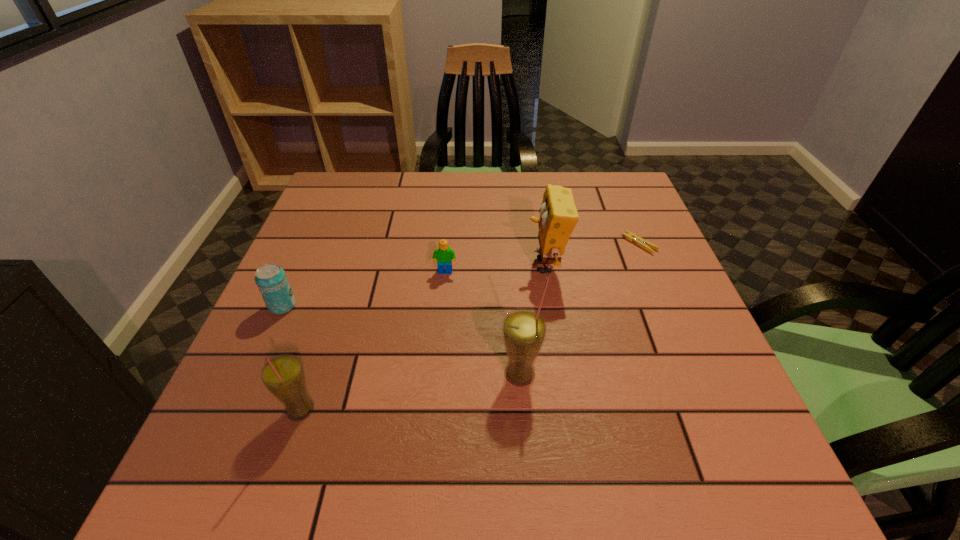
I want to click on free space that is in between the fourth object from right to left and the sponge, so click(x=495, y=269).

Locate an element on the screen. This screenshot has width=960, height=540. empty location between the Lego and the sponge is located at coordinates pyautogui.click(x=495, y=269).

Identify the location of empty location between the leftmost object and the rightmost object. Image resolution: width=960 pixels, height=540 pixels. (461, 275).

Where is `empty space that is in between the Lego and the sponge`? empty space that is in between the Lego and the sponge is located at coordinates (495, 269).

You are a GUI agent. You are given a task and a screenshot of the screen. Output one action in this format:
    pyautogui.click(x=<x>, y=<y>)
    Task: Click on the third closest object to the sponge
    
    Given the screenshot: What is the action you would take?
    pyautogui.click(x=444, y=255)

This screenshot has height=540, width=960. I want to click on the fifth closest object to the clothespin, so click(x=271, y=280).

The width and height of the screenshot is (960, 540). I want to click on blank space that satisfies the following two spatial constraints: 1. on the face of the second nearest object; 2. on the left side of the Lego, so click(x=437, y=374).

Where is `vacant area that satisfies the following two spatial constraints: 1. on the front side of the tallest object; 2. on the left side of the leftmost object`? Image resolution: width=960 pixels, height=540 pixels. vacant area that satisfies the following two spatial constraints: 1. on the front side of the tallest object; 2. on the left side of the leftmost object is located at coordinates (252, 374).

Image resolution: width=960 pixels, height=540 pixels. In order to click on free space that satisfies the following two spatial constraints: 1. on the face of the Lego; 2. on the right side of the taller straw for drinking in this screenshot , I will do `click(437, 374)`.

Where is `vacant point that satisfies the following two spatial constraints: 1. on the back side of the second nearest object; 2. on the right side of the nearest object`? vacant point that satisfies the following two spatial constraints: 1. on the back side of the second nearest object; 2. on the right side of the nearest object is located at coordinates (312, 374).